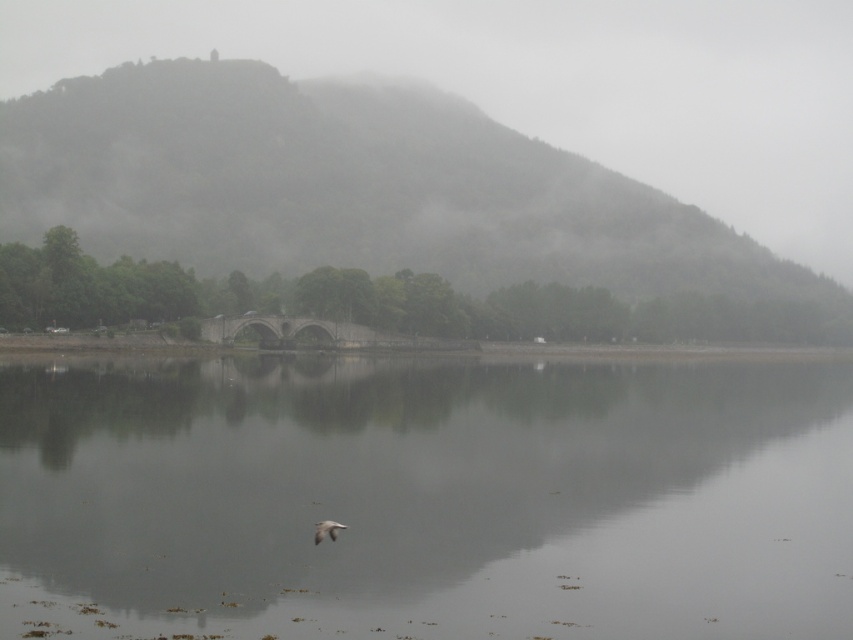
Is smooth gray water at center further to the viewer compared to foggy green hillside at upper center?

No, smooth gray water at center is closer to the viewer.

Can you confirm if smooth gray water at center is taller than foggy green hillside at upper center?

No.

Describe the element at coordinates (426, 499) in the screenshot. I see `smooth gray water at center` at that location.

You are a GUI agent. You are given a task and a screenshot of the screen. Output one action in this format:
    pyautogui.click(x=<x>, y=<y>)
    Task: Click on the smooth gray water at center
    
    Given the screenshot: What is the action you would take?
    pyautogui.click(x=426, y=499)

Who is more forward, [558,518] or [315,538]?

Positioned in front is point [315,538].

Between smooth gray water at center and white feathered bird at lower center, which one is positioned lower?

smooth gray water at center is lower down.

Does point (91, 515) lie in front of point (328, 528)?

No, (91, 515) is further to viewer.

Identify the location of smooth gray water at center. The image size is (853, 640). (426, 499).

Which is behind, point (157, 65) or point (321, 520)?

Point (157, 65)

Who is higher up, foggy green hillside at upper center or white feathered bird at lower center?

foggy green hillside at upper center

Does point (479, 260) lie in front of point (328, 529)?

No, (479, 260) is further to viewer.

Where is `foggy green hillside at upper center`? The width and height of the screenshot is (853, 640). foggy green hillside at upper center is located at coordinates (354, 189).